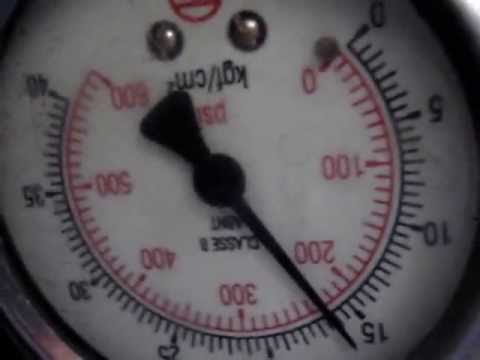
Locate an element on the screen. This screenshot has width=480, height=360. timer is located at coordinates (280, 185).